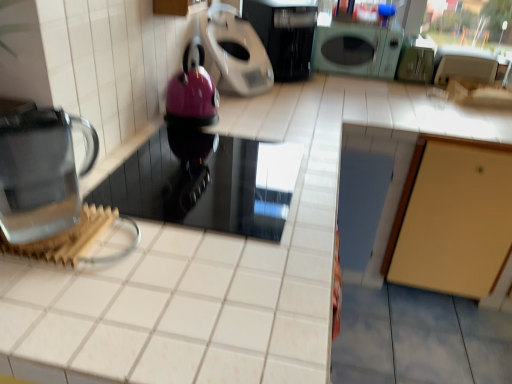
Find the location of `free spot to the right of metallic silver scale at upper center, positioned as the 1th kitchen appliance in left-to-right order`. free spot to the right of metallic silver scale at upper center, positioned as the 1th kitchen appliance in left-to-right order is located at coordinates (301, 100).